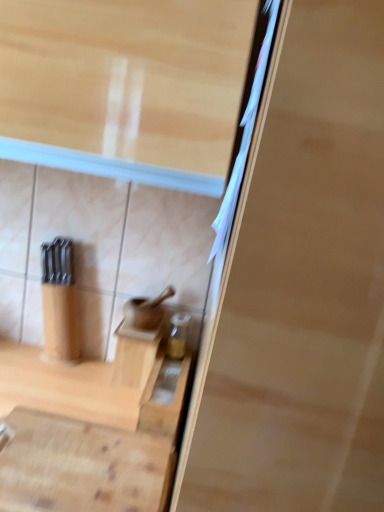
This screenshot has height=512, width=384. What are the coordinates of `free spot above wooden cutting board at lower center, the first cabinetry in the front-to-back sequence (from a real-world perspective)` in the screenshot? It's located at (71, 460).